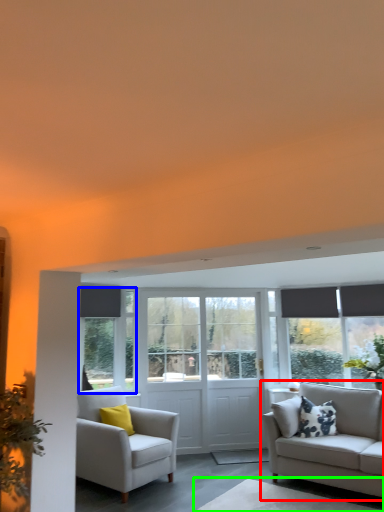
Question: Which is nearer to the studio couch (highlighted by a red box)? window (highlighted by a blue box) or table (highlighted by a green box).

Choices:
 (A) window
 (B) table

Answer: (B)